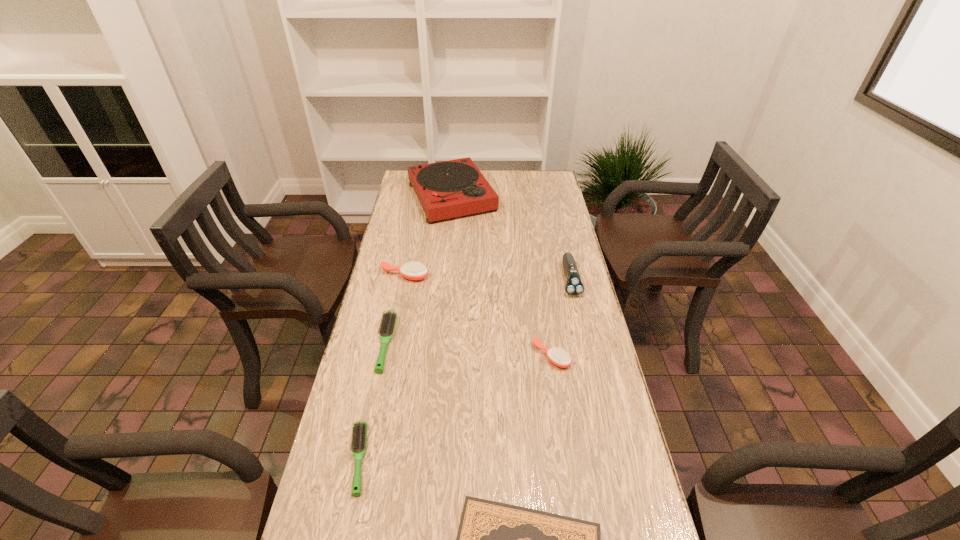
Where is `the farthest object`? This screenshot has width=960, height=540. the farthest object is located at coordinates (453, 188).

What are the coordinates of `the tallest object` in the screenshot? It's located at click(453, 188).

The height and width of the screenshot is (540, 960). I want to click on the sixth shortest object, so click(574, 286).

Where is `the rightmost object`? The width and height of the screenshot is (960, 540). the rightmost object is located at coordinates (574, 286).

Where is `the left orange hairbrush`? the left orange hairbrush is located at coordinates (414, 270).

Find the location of a particular element. The image size is (960, 540). the farthest hairbrush is located at coordinates (414, 270).

Locate an element on the screen. Image resolution: width=960 pixels, height=540 pixels. the farther light hairbrush is located at coordinates (388, 322).

I want to click on the smaller orange hairbrush, so click(x=557, y=356).

At what (x,y) coordinates should I click in order to perform the action: click on the right orange hairbrush. Please return your answer as a coordinate pair (x, y). The height and width of the screenshot is (540, 960). Looking at the image, I should click on (557, 356).

At what (x,y) coordinates should I click in order to perform the action: click on the smaller light hairbrush. Please return your answer as a coordinate pair (x, y). This screenshot has height=540, width=960. Looking at the image, I should click on (359, 437).